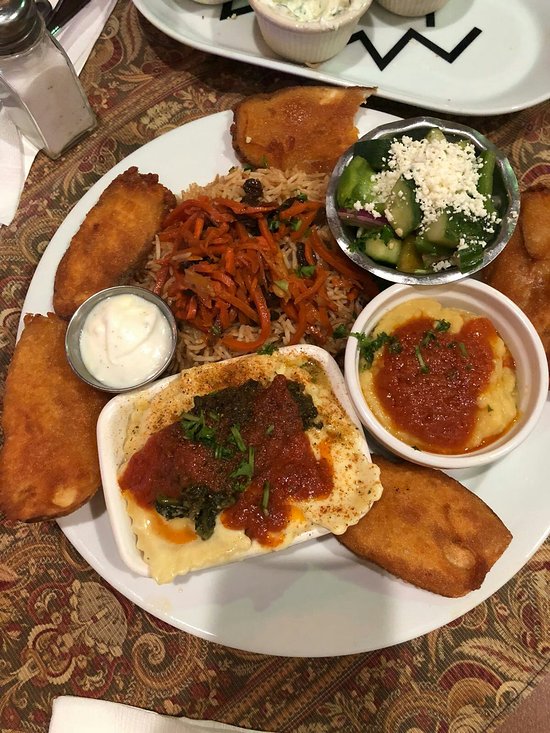
Identify the location of metal dish. This screenshot has width=550, height=733. (429, 125), (84, 380).